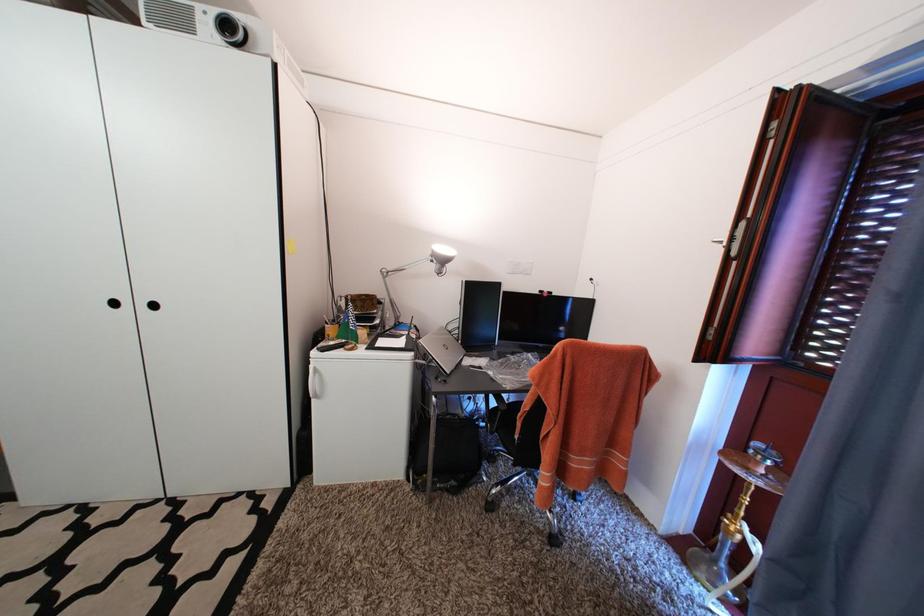
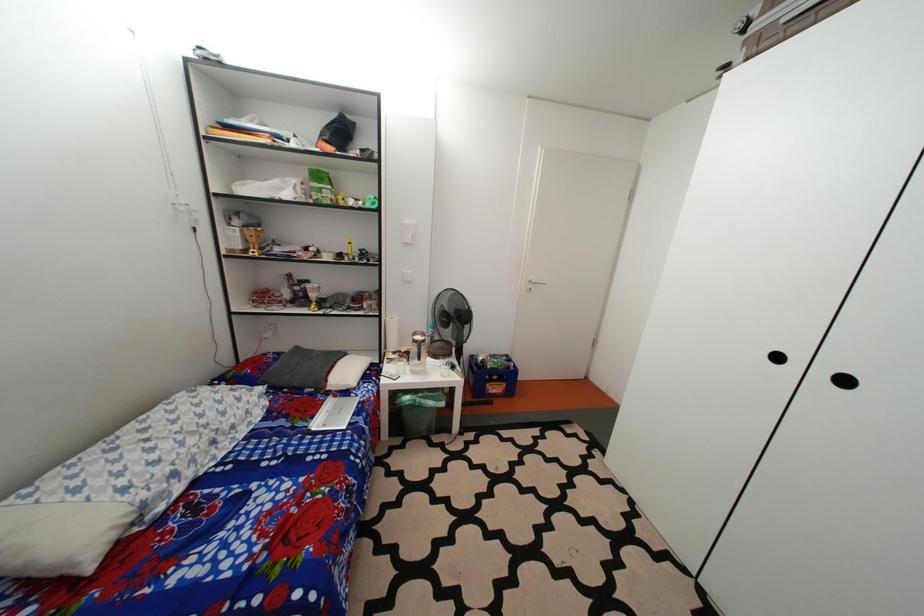
Question: The camera is either moving clockwise (left) or counter-clockwise (right) around the object. The first image is from the beginning of the video and the second image is from the end. Is the camera moving left or right when shooting the video?

Choices:
 (A) Left
 (B) Right

Answer: (B)